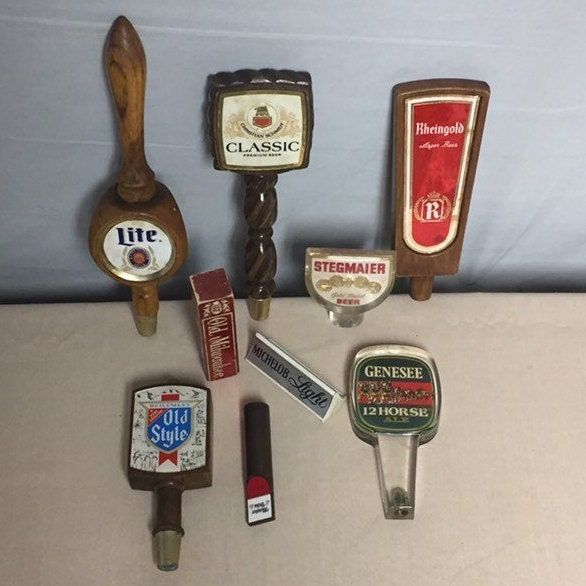
This screenshot has height=586, width=586. Find the location of `beer pull handles`. beer pull handles is located at coordinates (120, 250), (243, 129), (436, 151), (367, 278), (221, 340), (318, 391), (267, 482), (166, 473), (420, 429).